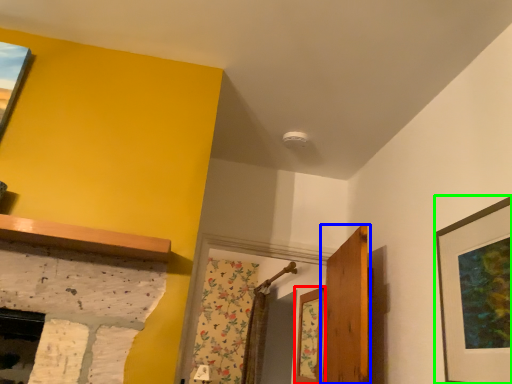
Question: Which is farther away from window (highlighted by a red box)? door (highlighted by a blue box) or picture frame (highlighted by a green box)?

Choices:
 (A) door
 (B) picture frame

Answer: (B)